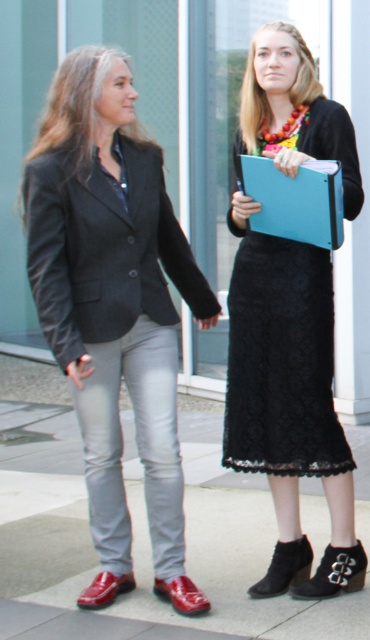
You are a photographer taking a picture of the two people in front of the building. You want to ensure that both the matte black blazer at left and the black lace skirt at center are clearly visible in the photo. Which person should be positioned closer to the camera to achieve this?

The matte black blazer at left should be positioned closer to the camera because the black lace skirt at center is behind it, so moving the person in the matte black blazer forward will help both be visible.

You are a photographer setting up a camera to capture the scene. You need to ensure that both the matte black blazer at left and the black lace skirt at center are fully visible in the frame. Given their sizes, which object might require you to adjust the camera angle to accommodate its width?

The matte black blazer at left has a larger width than the black lace skirt at center, so it might require adjusting the camera angle to ensure it fits within the frame.